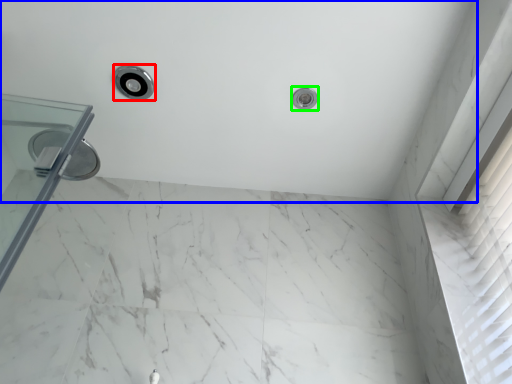
Question: Based on their relative distances, which object is farther from shower (highlighted by a red box)? Choose from bath (highlighted by a blue box) and shower (highlighted by a green box).

Choices:
 (A) bath
 (B) shower

Answer: (B)